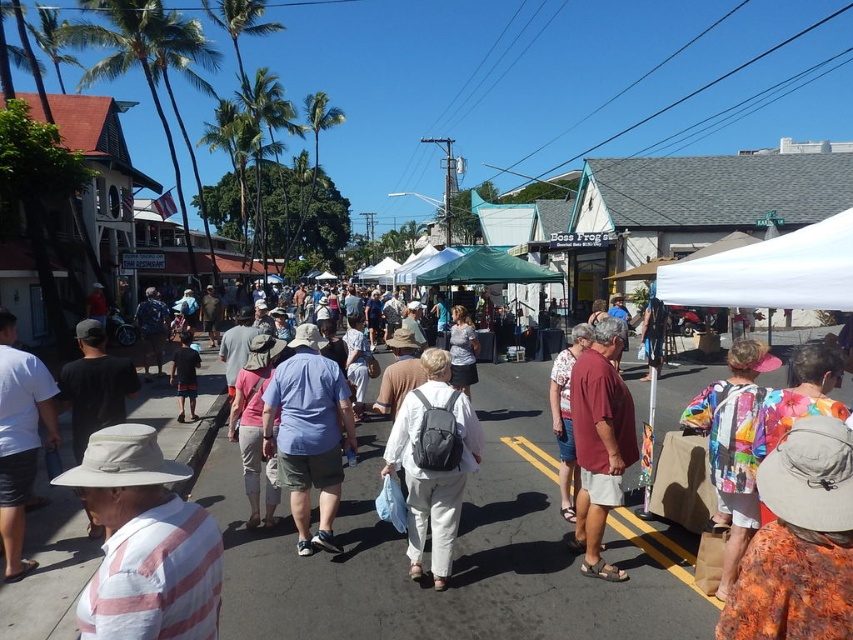
Is white striped shirt at left below matte red shirt at center?

Yes.

Does point (67, 477) come closer to viewer compared to point (553, 428)?

Yes, point (67, 477) is in front of point (553, 428).

I want to click on white striped shirt at left, so click(x=144, y=544).

You are a GUI agent. You are given a task and a screenshot of the screen. Output one action in this format:
    pyautogui.click(x=<x>, y=<y>)
    Task: Click on the white striped shirt at left
    
    Given the screenshot: What is the action you would take?
    144,544

Is matte gray backpack at center positioned behind matte red shirt at center?

No, matte gray backpack at center is closer to the viewer.

In the scene shown: Does matte gray backpack at center have a greater width compared to matte red shirt at center?

Yes, matte gray backpack at center is wider than matte red shirt at center.

Between point (410, 560) and point (572, 477), which one is positioned in front?

Point (410, 560)

This screenshot has width=853, height=640. Identify the location of matte gray backpack at center. (432, 467).

Is white striped shirt at left shorter than dark blue shorts at center?

Indeed, white striped shirt at left has a lesser height compared to dark blue shorts at center.

Does point (155, 621) come in front of point (199, 362)?

Yes.

Locate an element on the screen. This screenshot has height=640, width=853. white striped shirt at left is located at coordinates (144, 544).